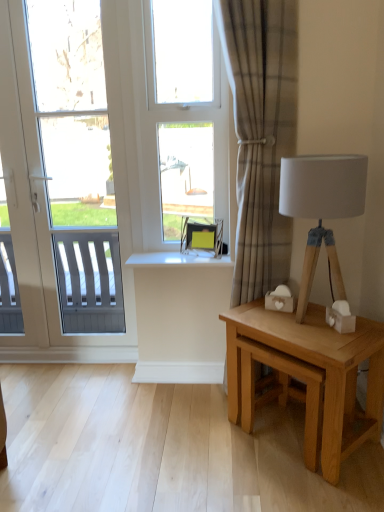
Locate an element on the screen. vacant position to the left of matte black swivel chair at center is located at coordinates (175, 252).